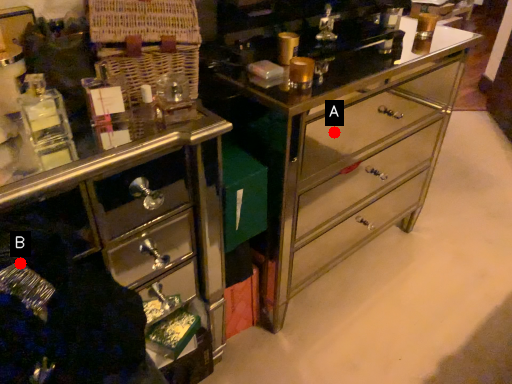
Question: Two points are circled on the image, labeled by A and B beside each circle. Which point is closer to the camera taking this photo?

Choices:
 (A) A is closer
 (B) B is closer

Answer: (B)